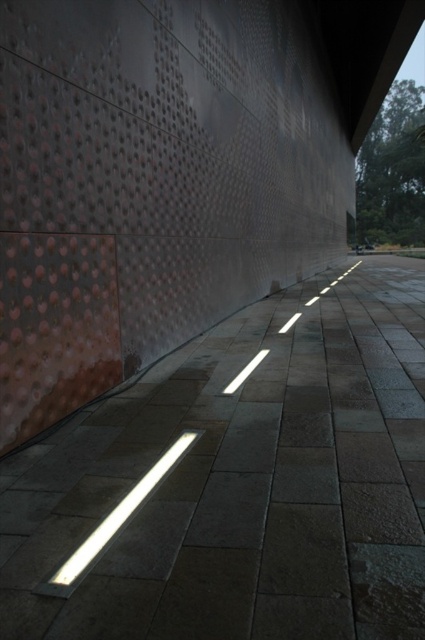
You are standing on the pathway in front of the textured wall. You notice two points marked on the ground. One is at point (261, 468) and the other at point (85, 552). Which point is closer to you as you face the wall?

Point (261, 468) is further to the viewer than point (85, 552), so the closer point to you is point (85, 552).

You are a pedestrian standing on the pathway and want to step onto the slate gray paving stone at center. There is a white glossy rectangular light at center nearby. Which object has a greater width that you should consider for your foot placement?

The slate gray paving stone at center has a greater width than the white glossy rectangular light at center, so you should consider stepping onto the slate gray paving stone at center for a wider foot placement.

Consider the image. You are standing on the pathway and see the slate gray paving stone at center and the white glossy rectangular light at center. Which object is closer to you?

The slate gray paving stone at center is closer to you since it is in front of the white glossy rectangular light at center.